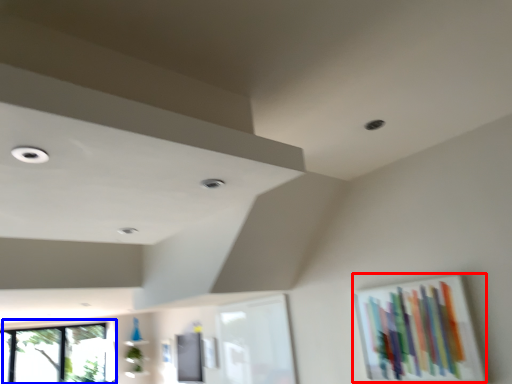
Question: Which object is further to the camera taking this photo, picture frame (highlighted by a red box) or window (highlighted by a blue box)?

Choices:
 (A) picture frame
 (B) window

Answer: (B)